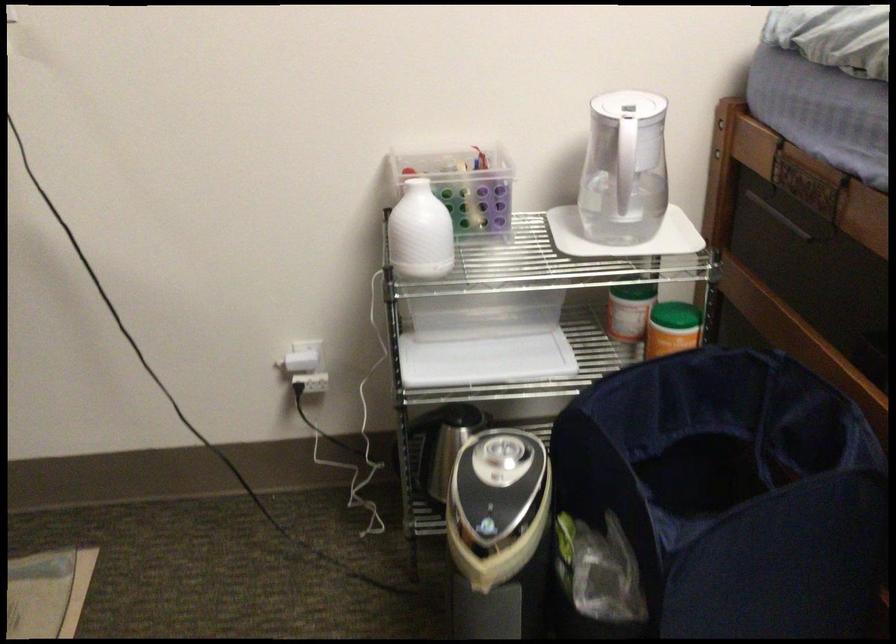
The width and height of the screenshot is (896, 644). In order to click on white container lid in this screenshot , I will do `click(624, 236)`.